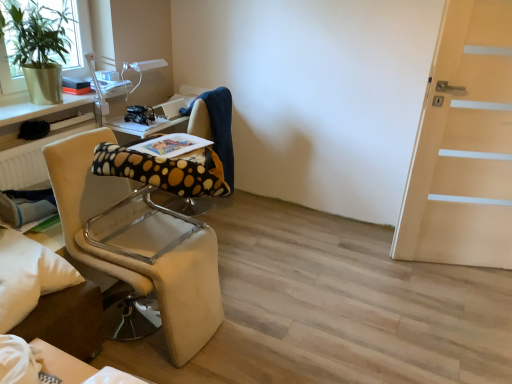
Image resolution: width=512 pixels, height=384 pixels. In order to click on space that is in front of light wood door at right in this screenshot , I will do `click(461, 301)`.